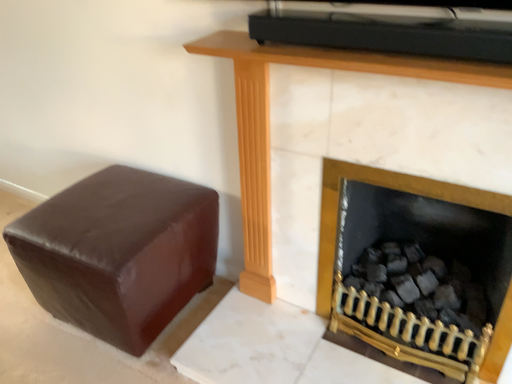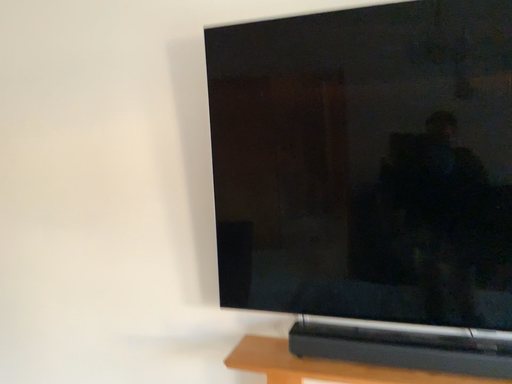
Question: How did the camera likely rotate when shooting the video?

Choices:
 (A) rotated upward
 (B) rotated downward

Answer: (A)